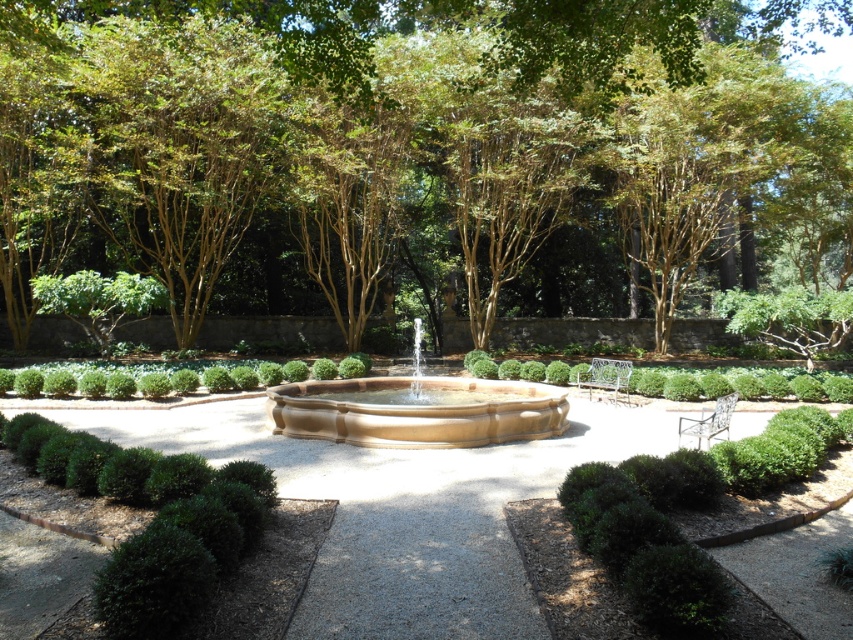
Is point (19, 35) closer to viewer compared to point (543, 401)?

Yes.

Who is more forward, (498, 240) or (347, 392)?

Point (347, 392)

Find the location of a particular element. brown smooth tree at upper center is located at coordinates (412, 134).

At what (x,y) coordinates should I click in order to perform the action: click on brown smooth tree at upper center. Please return your answer as a coordinate pair (x, y). The width and height of the screenshot is (853, 640). Looking at the image, I should click on (412, 134).

Can you confirm if matte stone fountain at center is wider than green textured hedge at center?

Yes, matte stone fountain at center is wider than green textured hedge at center.

Does matte stone fountain at center have a smaller size compared to green textured hedge at center?

No, matte stone fountain at center is not smaller than green textured hedge at center.

Between point (415, 420) and point (361, 372), which one is positioned behind?

The point (361, 372) is more distant.

You are a GUI agent. You are given a task and a screenshot of the screen. Output one action in this format:
    pyautogui.click(x=<x>, y=<y>)
    Task: Click on the matte stone fountain at center
    
    Given the screenshot: What is the action you would take?
    pyautogui.click(x=416, y=410)

Is point (26, 332) more distant than point (39, 369)?

That is True.

Who is positioned more to the left, brown smooth tree at upper center or green textured hedge at center?

Positioned to the left is green textured hedge at center.

Identify the location of brown smooth tree at upper center. This screenshot has width=853, height=640. (412, 134).